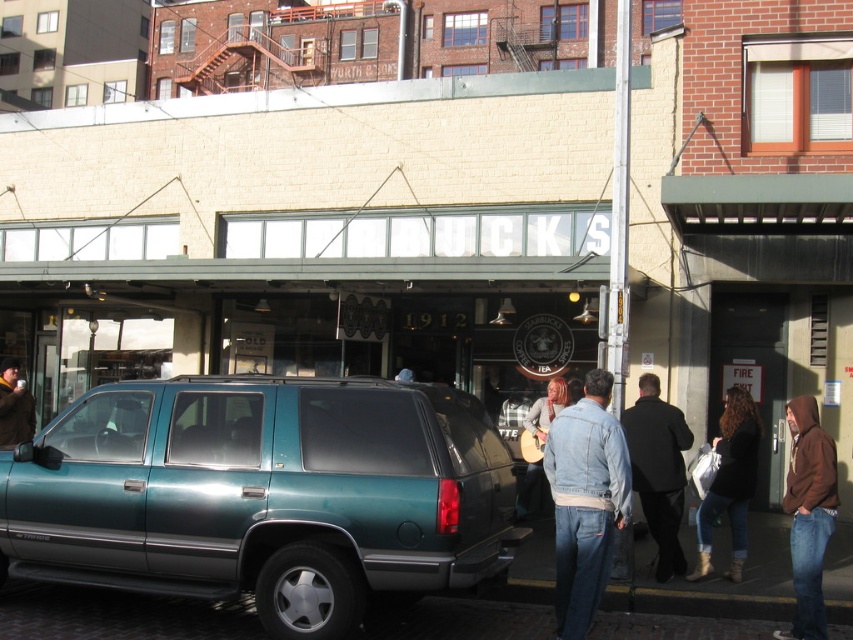
Does point (822, 476) come closer to viewer compared to point (666, 404)?

Yes.

Between point (790, 508) and point (639, 456), which one is positioned behind?

The point (639, 456) is behind.

Describe the element at coordinates (808, 515) in the screenshot. The image size is (853, 640). I see `brown leather jacket at lower right` at that location.

The width and height of the screenshot is (853, 640). In order to click on brown leather jacket at lower right in this screenshot , I will do `click(808, 515)`.

Which of these two, denim jacket at lower right or silver metallic tire at lower left, stands taller?

Standing taller between the two is denim jacket at lower right.

Which is above, denim jacket at lower right or silver metallic tire at lower left?

denim jacket at lower right

Does point (575, 499) come in front of point (292, 563)?

That is False.

Locate an element on the screen. The height and width of the screenshot is (640, 853). denim jacket at lower right is located at coordinates (585, 500).

Which is in front, point (593, 524) or point (9, 440)?

Point (593, 524) is in front.

Between denim jacket at lower right and brown leather jacket at left, which one is positioned lower?

denim jacket at lower right is lower down.

Who is more distant from viewer, (590, 536) or (12, 376)?

The point (12, 376) is more distant.

Where is `denim jacket at lower right`? denim jacket at lower right is located at coordinates (585, 500).